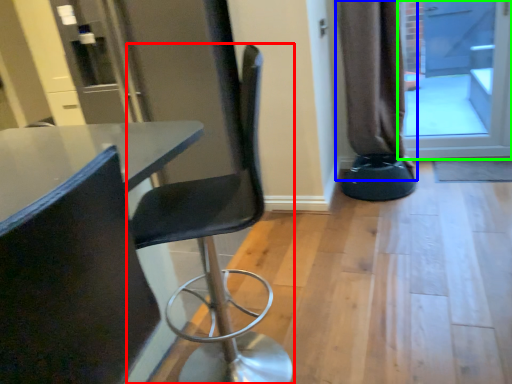
Question: Which is nearer to the chair (highlighted by a red box)? curtain (highlighted by a blue box) or screen door (highlighted by a green box).

Choices:
 (A) curtain
 (B) screen door

Answer: (A)